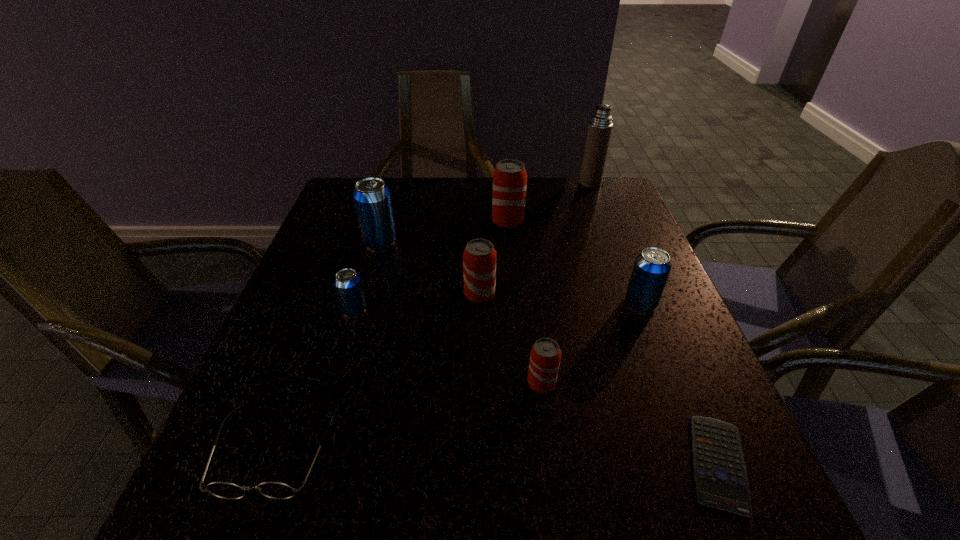
Identify the location of the fifth closest beer can to the farthest beer can. (545, 355).

Locate an element on the screen. the third closest beer can to the rightmost blue beer can is located at coordinates (509, 177).

Where is `the closest orange beer can relative to the calculator`? Image resolution: width=960 pixels, height=540 pixels. the closest orange beer can relative to the calculator is located at coordinates (545, 355).

The width and height of the screenshot is (960, 540). I want to click on orange beer can that stands as the closest to the calculator, so click(x=545, y=355).

Locate which blue beer can is the second closest to the biggest orange beer can. Please provide its 2D coordinates. Your answer should be formatted as a tuple, i.e. [(x, y)], where the tuple contains the x and y coordinates of a point satisfying the conditions above.

[(651, 269)]

Identify which blue beer can is the second closest to the tallest object. Please provide its 2D coordinates. Your answer should be formatted as a tuple, i.e. [(x, y)], where the tuple contains the x and y coordinates of a point satisfying the conditions above.

[(372, 199)]

The height and width of the screenshot is (540, 960). In order to click on vacant point that satisfies the following two spatial constraints: 1. on the front side of the tallest object; 2. on the left side of the rightmost beer can in this screenshot , I will do `click(636, 303)`.

At what (x,y) coordinates should I click in order to perform the action: click on free region that satisfies the following two spatial constraints: 1. on the front side of the biggest blue beer can; 2. on the left side of the rightmost beer can. Please return your answer as a coordinate pair (x, y). The image size is (960, 540). Looking at the image, I should click on (363, 303).

Find the location of `free space that satisfies the following two spatial constraints: 1. on the front side of the farthest object; 2. on the left side of the shortest object`. free space that satisfies the following two spatial constraints: 1. on the front side of the farthest object; 2. on the left side of the shortest object is located at coordinates (698, 464).